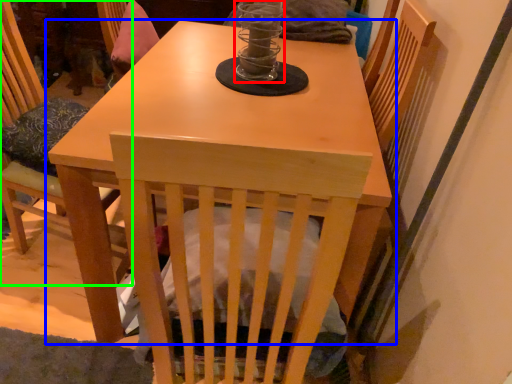
Question: Which object is positioned farthest from candle holder (highlighted by a red box)? Select from table (highlighted by a blue box) and chair (highlighted by a green box).

Choices:
 (A) table
 (B) chair

Answer: (B)